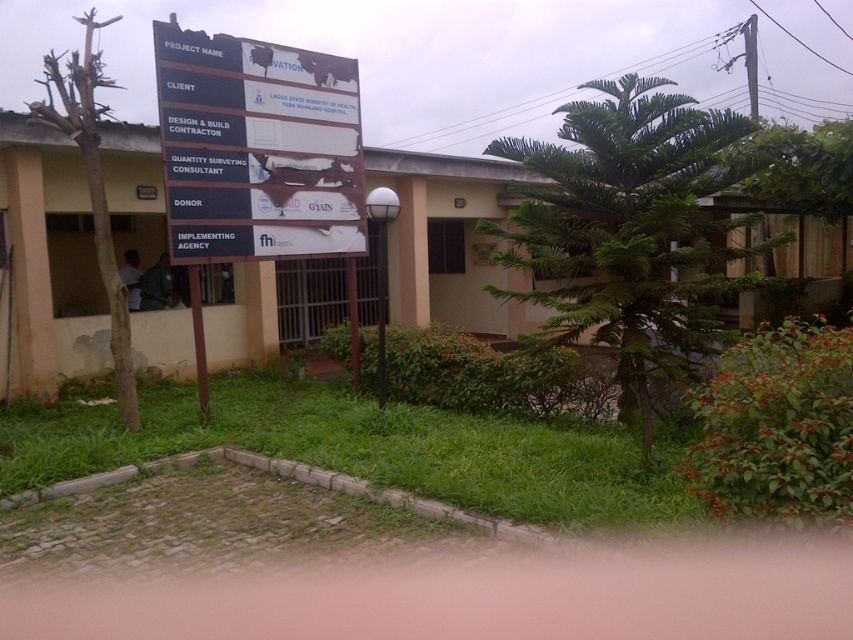
You are a visitor approaching the building and notice the green leafy tree at center and the white plastic sign at center. Which object is positioned to the left when facing the building?

The white plastic sign at center is positioned to the left of the green leafy tree at center when facing the building.

What is the color and type of the object located at the coordinates point (x=630, y=228)?

The point (x=630, y=228) marks a green leafy tree at center.

You are standing at the point closest to the building. Which of the two points, point (712,264) or point (183,237), is farther away from you?

Point (712,264) is farther away from you because it is behind point (183,237), which is closer to you.